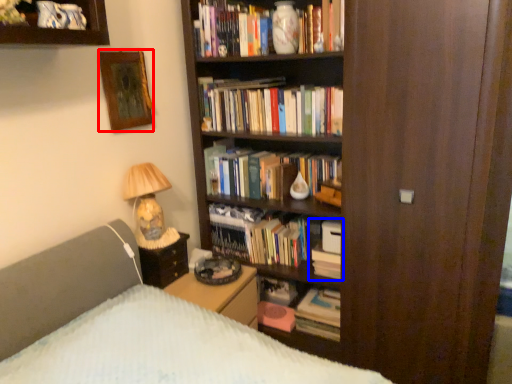
Question: Which object is closer to the camera taking this photo, picture frame (highlighted by a red box) or book (highlighted by a blue box)?

Choices:
 (A) picture frame
 (B) book

Answer: (A)